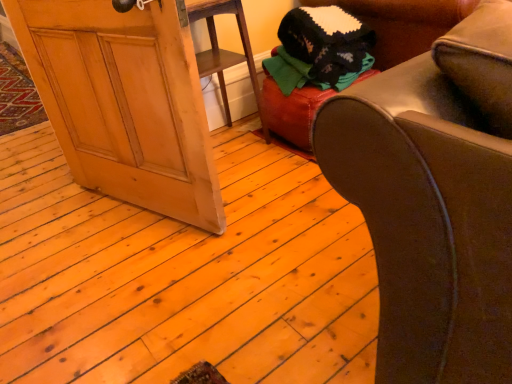
Where is `vacant space to the right of wooden screen door at lower left`? The width and height of the screenshot is (512, 384). vacant space to the right of wooden screen door at lower left is located at coordinates (261, 199).